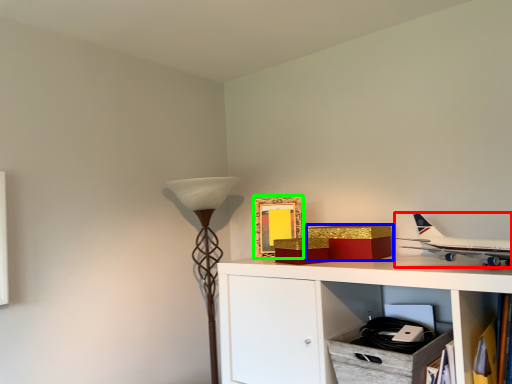
Question: Based on their relative distances, which object is farther from airplane (highlighted by a red box)? Choose from box (highlighted by a blue box) and picture frame (highlighted by a green box).

Choices:
 (A) box
 (B) picture frame

Answer: (B)